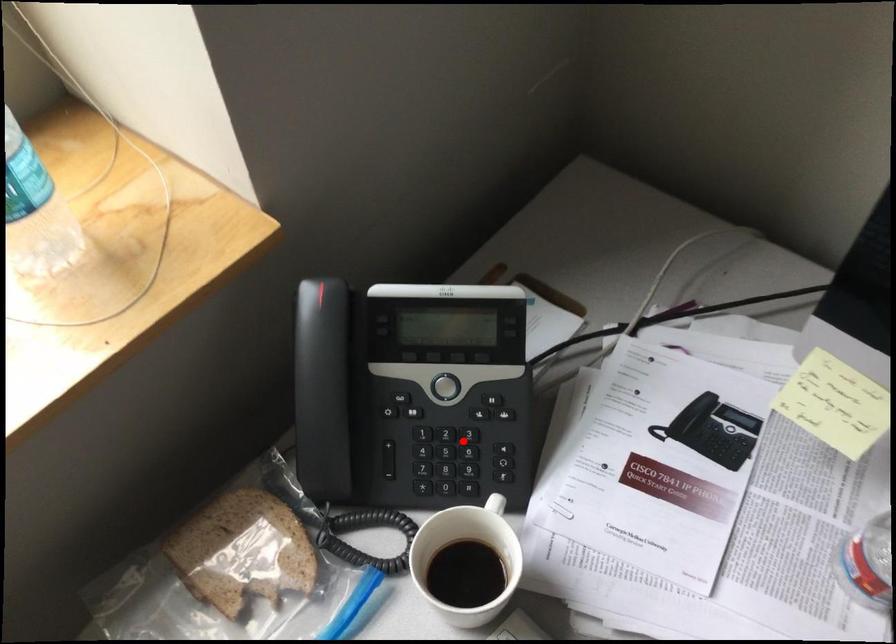
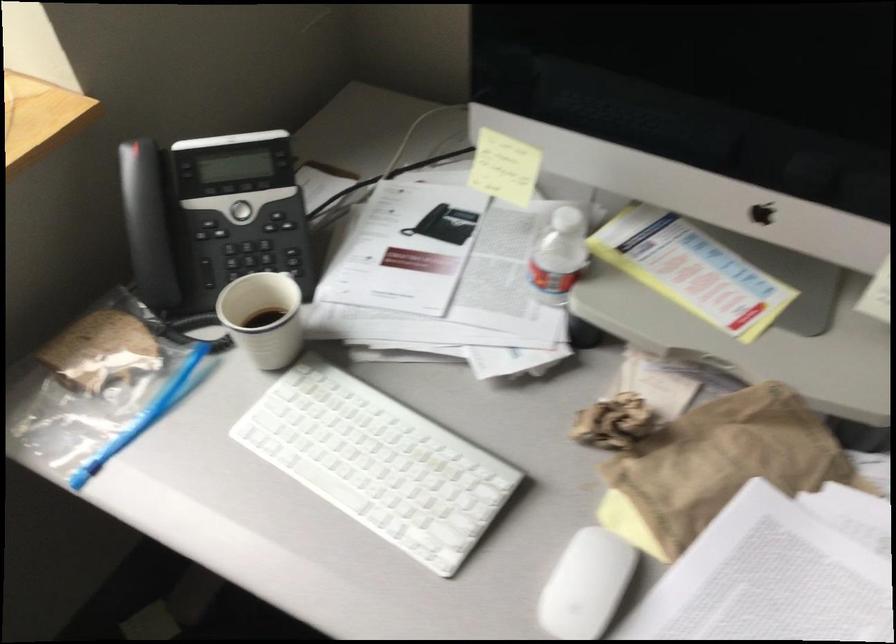
The point at the highlighted location is marked in the first image. Where is the corresponding point in the second image?

(259, 250)